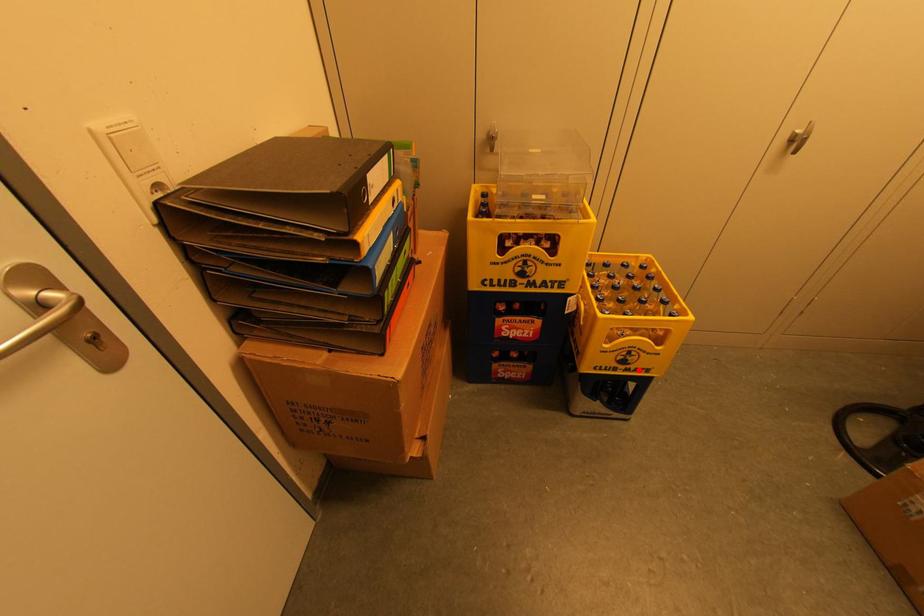
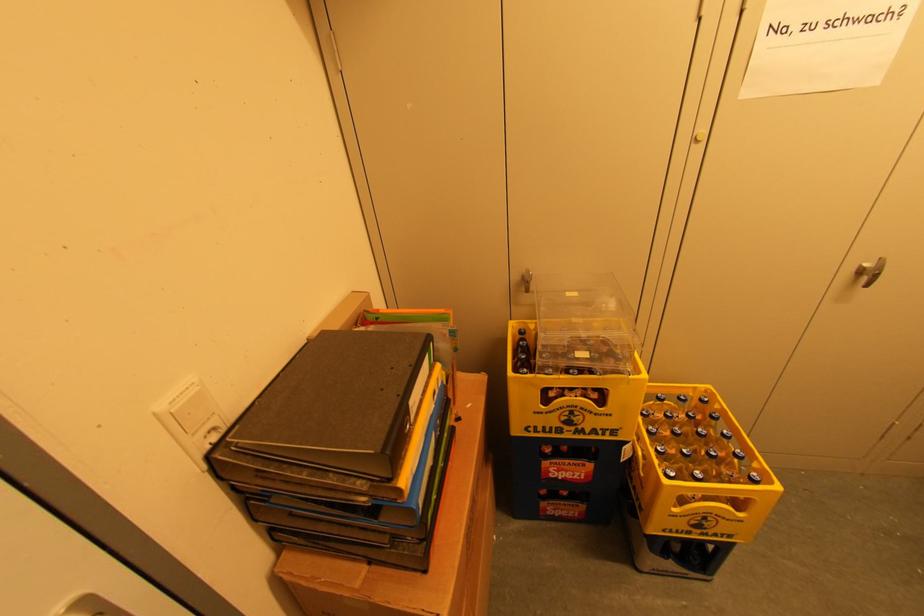
Where in the second image is the point corresponding to the highlighted location from the first image?

(718, 535)